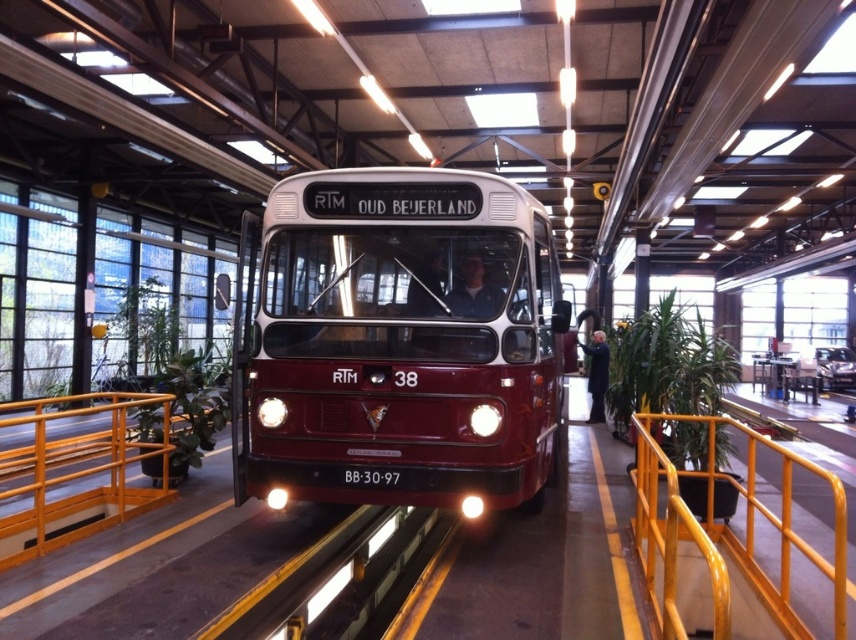
Question: Does yellow metal railing at center appear on the left side of yellow metal rail at lower left?

Choices:
 (A) no
 (B) yes

Answer: (A)

Question: Can you confirm if yellow metal railing at center is positioned below yellow metal rail at lower left?

Choices:
 (A) no
 (B) yes

Answer: (B)

Question: Which point appears farthest from the camera in this image?

Choices:
 (A) (377, 301)
 (B) (79, 401)
 (C) (687, 532)

Answer: (B)

Question: Which point is closer to the camera?

Choices:
 (A) yellow metal railing at center
 (B) maroon matte bus at center

Answer: (A)

Question: Which of these objects is positioned closest to the yellow metal railing at center?

Choices:
 (A) maroon matte bus at center
 (B) yellow metal rail at lower left

Answer: (A)

Question: Can you confirm if maroon matte bus at center is thinner than yellow metal rail at lower left?

Choices:
 (A) yes
 (B) no

Answer: (B)